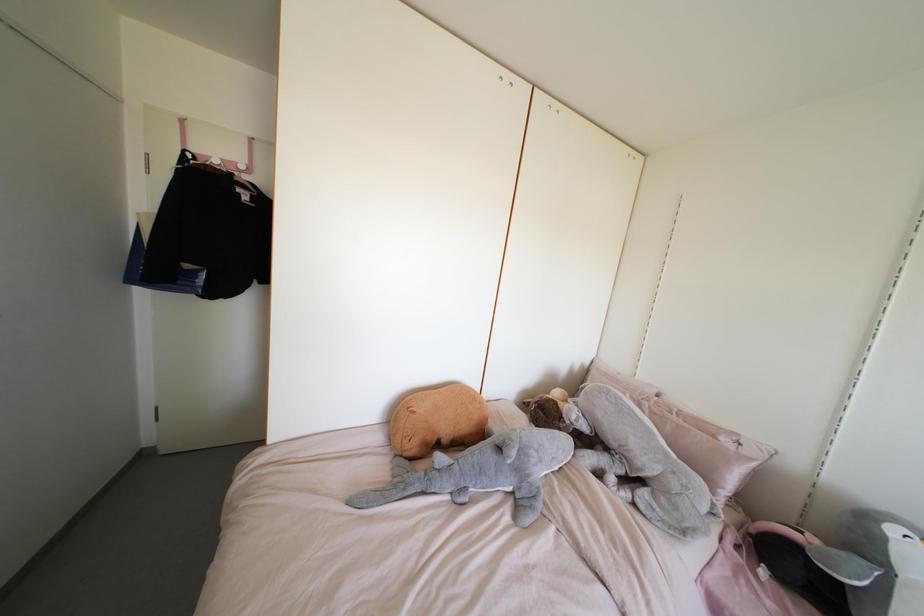
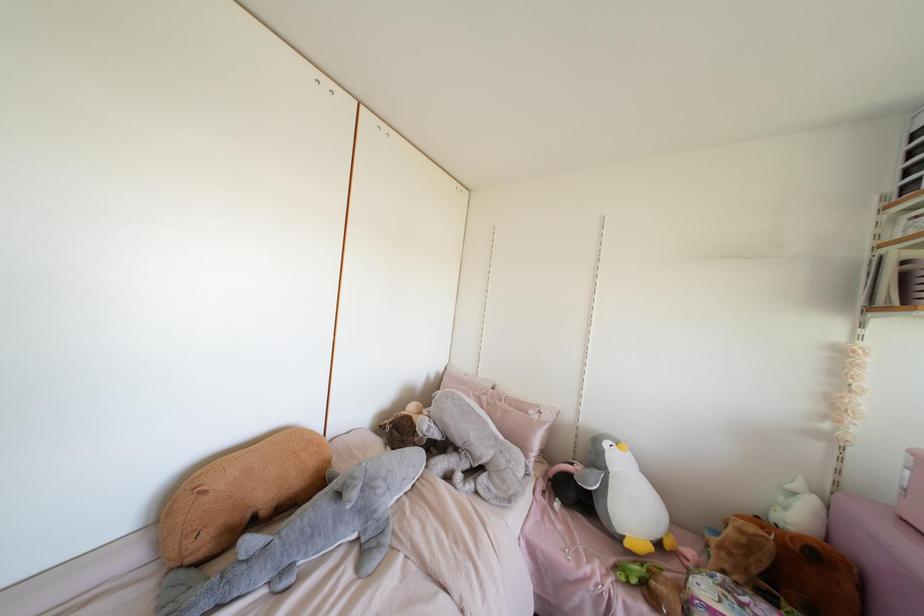
Question: I am providing you with two images of the same scene from different viewpoints. Please identify which objects are invisible in image2.

Choices:
 (A) brown stuffed animal
 (B) penguin stuffed animal
 (C) grey shark pillow
 (D) none of these

Answer: (D)